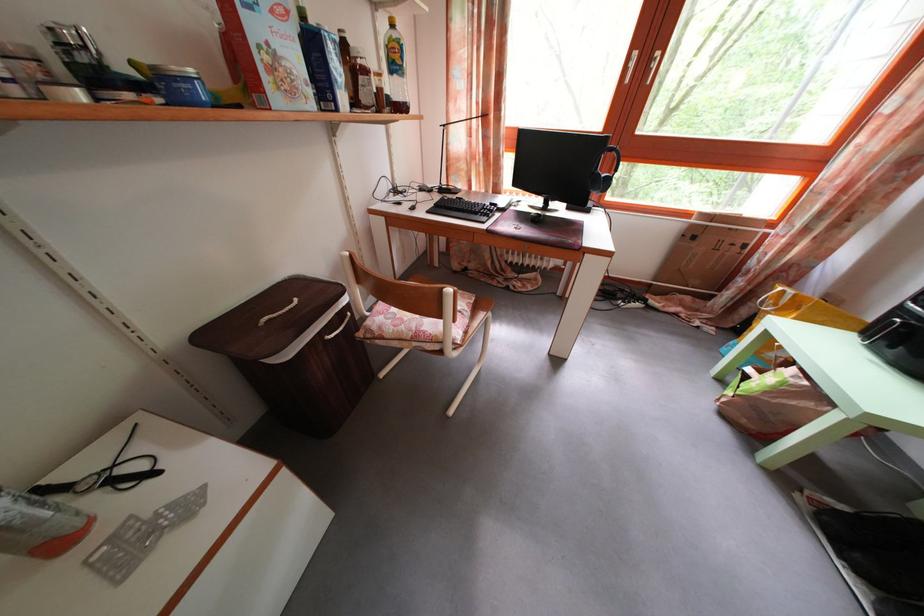
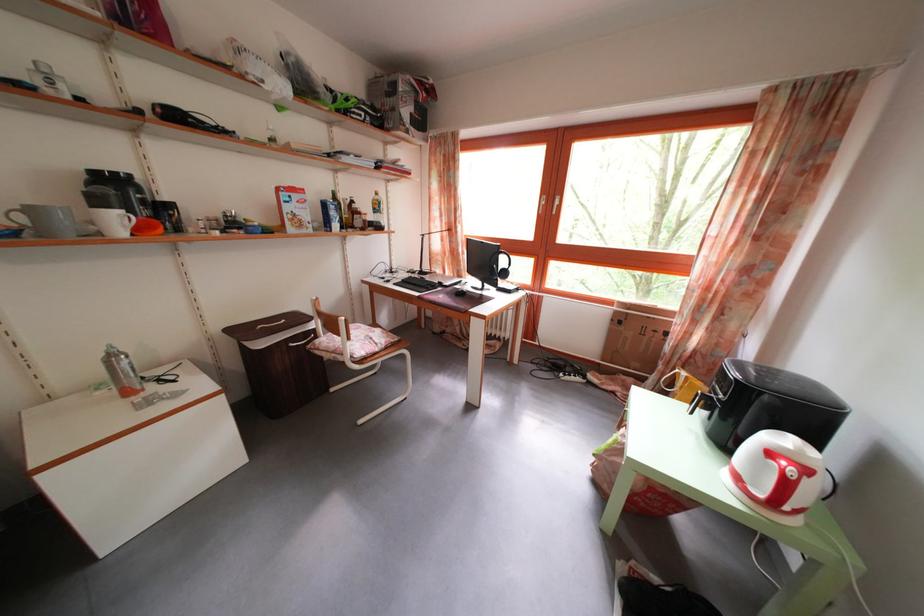
What movement of the cameraman would produce the second image?

The cameraman moved toward right, backward.